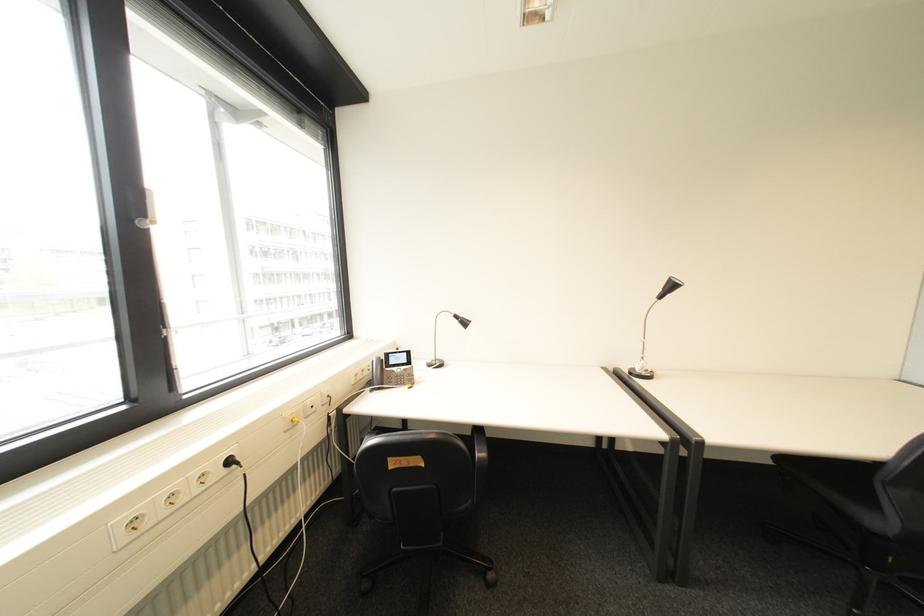
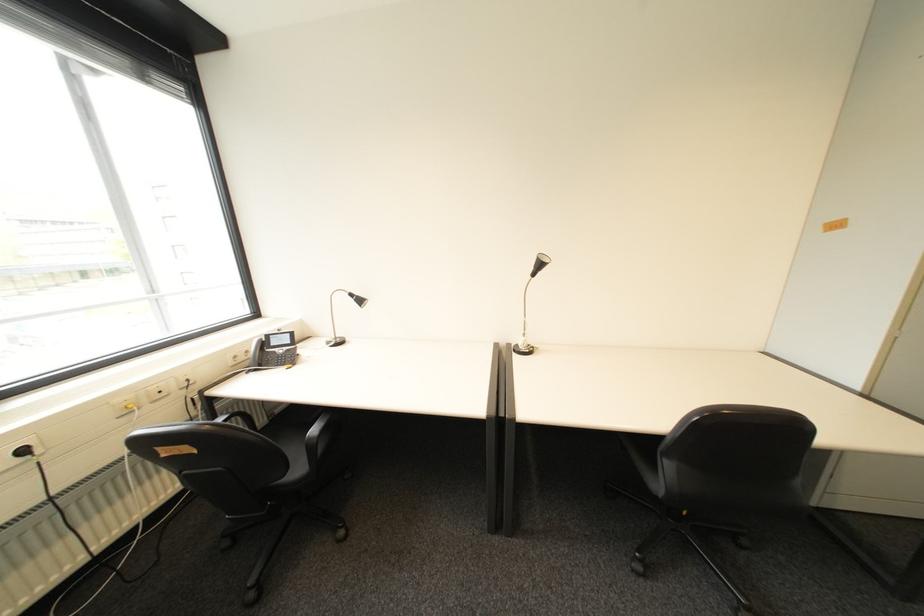
Find the pixel in the second image that matches point 491,460 in the first image.

(321, 439)